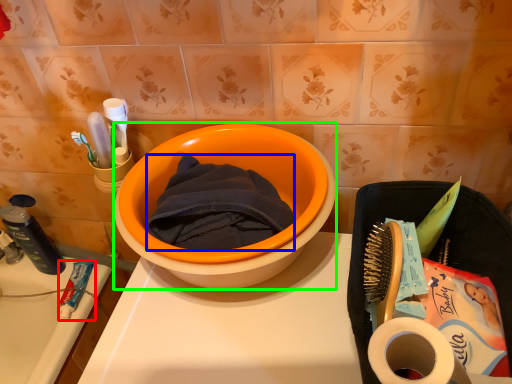
Question: Which object is the closest to the stationery (highlighted by a red box)? Choose among these: bath towel (highlighted by a blue box) or basin (highlighted by a green box).

Choices:
 (A) bath towel
 (B) basin

Answer: (A)